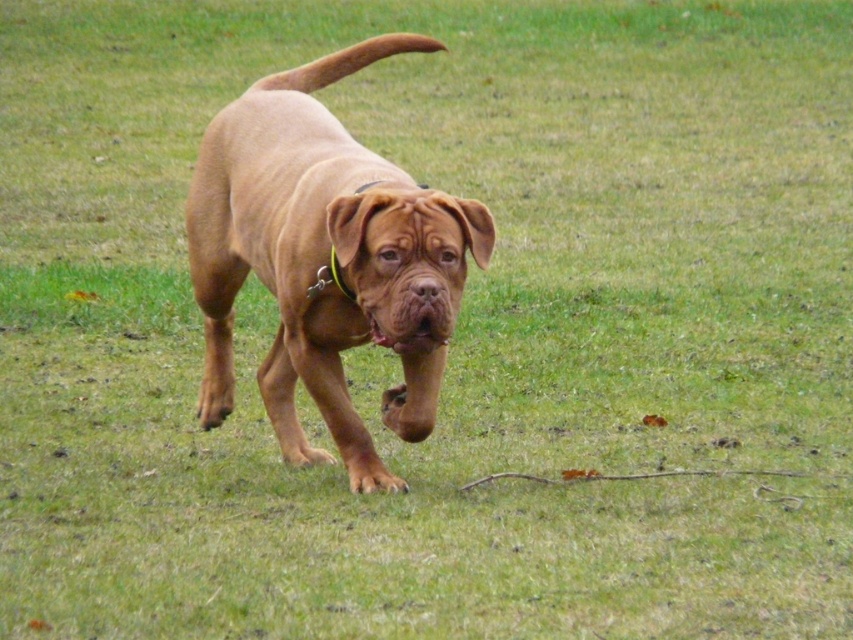
Question: Can you confirm if smooth brown dog at center is positioned to the left of green fabric collar at center?

Choices:
 (A) no
 (B) yes

Answer: (B)

Question: Can you confirm if smooth brown dog at center is positioned to the left of green fabric collar at center?

Choices:
 (A) yes
 (B) no

Answer: (A)

Question: In this image, where is smooth brown dog at center located relative to green fabric collar at center?

Choices:
 (A) left
 (B) right

Answer: (A)

Question: Among these points, which one is nearest to the camera?

Choices:
 (A) (351, 298)
 (B) (335, 412)

Answer: (A)

Question: Which object appears closest to the camera in this image?

Choices:
 (A) smooth brown dog at center
 (B) green fabric collar at center

Answer: (A)